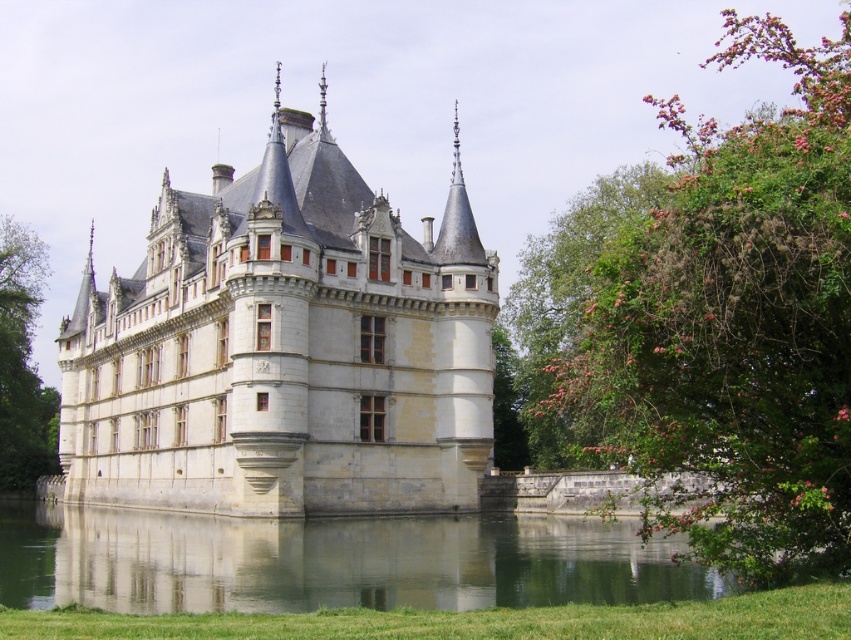
Question: Among these points, which one is nearest to the camera?

Choices:
 (A) pyautogui.click(x=272, y=598)
 (B) pyautogui.click(x=44, y=250)

Answer: (A)

Question: Can you confirm if white stone castle at center is positioned to the right of transparent water at lower center?

Choices:
 (A) no
 (B) yes

Answer: (B)

Question: Which of the following is the closest to the observer?

Choices:
 (A) (364, 570)
 (B) (231, 316)

Answer: (A)

Question: Does white stone castle at center have a smaller size compared to green leafy bush at right?

Choices:
 (A) no
 (B) yes

Answer: (B)

Question: Can you confirm if green leafy bush at right is positioned above transparent water at lower center?

Choices:
 (A) no
 (B) yes

Answer: (B)

Question: Which object is positioned farthest from the white stone castle at center?

Choices:
 (A) transparent water at lower center
 (B) green leafy tree at left
 (C) green leafy bush at right

Answer: (B)